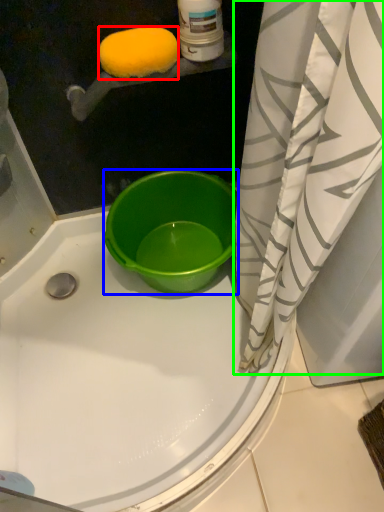
Question: Which object is positioned farthest from lemon (highlighted by a red box)? Select from bucket (highlighted by a blue box) and curtain (highlighted by a green box).

Choices:
 (A) bucket
 (B) curtain

Answer: (A)